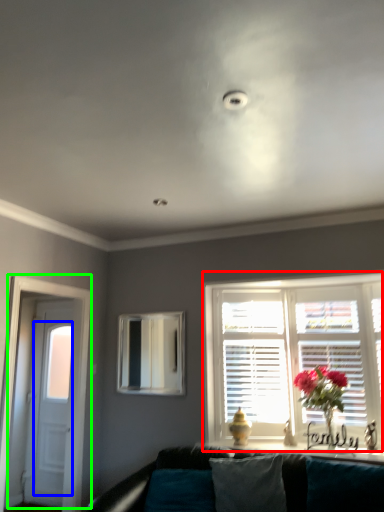
Question: Based on their relative distances, which object is farther from window (highlighted by a red box)? Choose from glass door (highlighted by a blue box) and door (highlighted by a green box).

Choices:
 (A) glass door
 (B) door

Answer: (A)